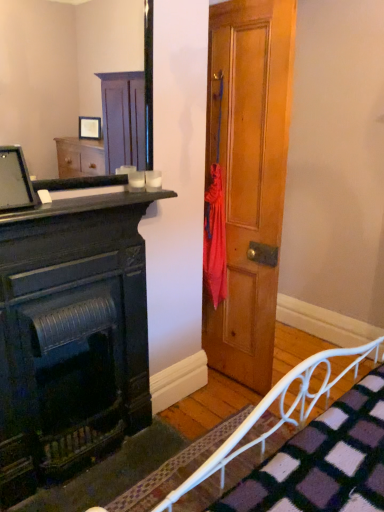
Question: From a real-world perspective, is white metal bed frame at lower right physically located above or below matte black monitor at upper left?

Choices:
 (A) below
 (B) above

Answer: (A)

Question: In the image, is white metal bed frame at lower right positioned in front of or behind matte black monitor at upper left?

Choices:
 (A) front
 (B) behind

Answer: (A)

Question: Which object is the closest to the matte black fireplace at left?

Choices:
 (A) matte black monitor at upper left
 (B) white metal bed frame at lower right
 (C) wooden door at center
 (D) wooden frame mirror at upper left

Answer: (A)

Question: Which of these objects is positioned farthest from the wooden door at center?

Choices:
 (A) wooden frame mirror at upper left
 (B) matte black monitor at upper left
 (C) matte black fireplace at left
 (D) white metal bed frame at lower right

Answer: (A)